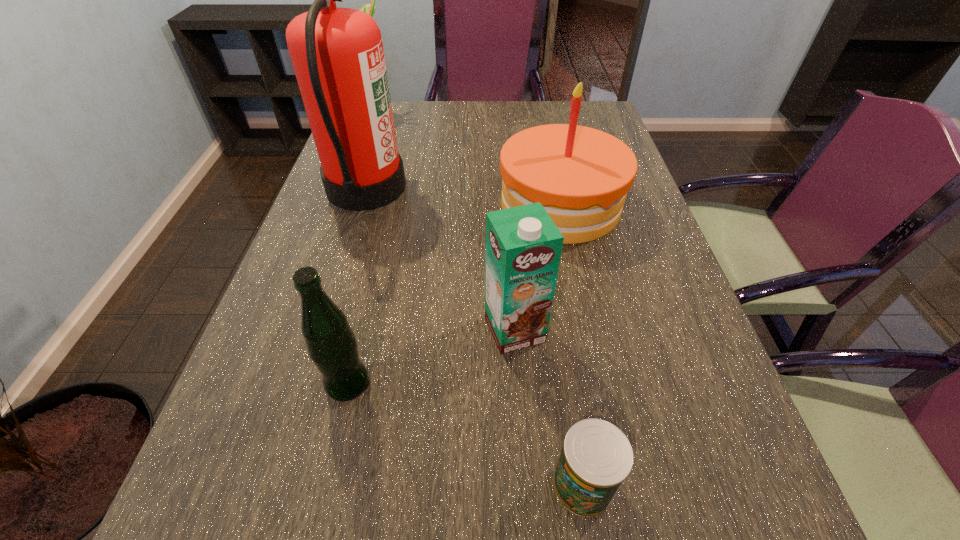
Where is `free space located on the right of the third nearest object`? This screenshot has height=540, width=960. free space located on the right of the third nearest object is located at coordinates (569, 329).

This screenshot has width=960, height=540. What are the coordinates of `free location located 0.350m on the right of the beer bottle` in the screenshot? It's located at (563, 384).

At what (x,y) coordinates should I click in order to perform the action: click on free spot located 0.190m on the back of the nearest object. Please return your answer as a coordinate pair (x, y). This screenshot has width=960, height=540. Looking at the image, I should click on (564, 356).

Image resolution: width=960 pixels, height=540 pixels. I want to click on object that is at the far edge, so click(x=367, y=8).

Find the location of a particular element. fire extinguisher positioned at the left edge is located at coordinates (337, 54).

Locate an element on the screen. The width and height of the screenshot is (960, 540). alcohol that is at the left edge is located at coordinates (367, 8).

Identify the location of beer bottle at the left edge. This screenshot has width=960, height=540. click(332, 346).

Identify the location of object situated at the right edge. Image resolution: width=960 pixels, height=540 pixels. (580, 175).

This screenshot has width=960, height=540. In order to click on object that is at the far left corner in this screenshot , I will do `click(367, 8)`.

Image resolution: width=960 pixels, height=540 pixels. Identify the location of vacant area at the far edge. (432, 113).